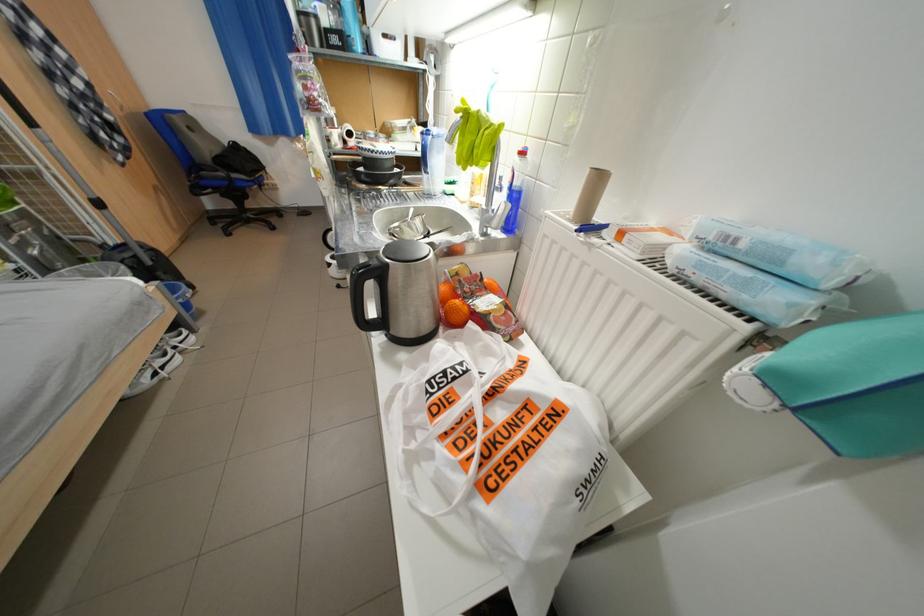
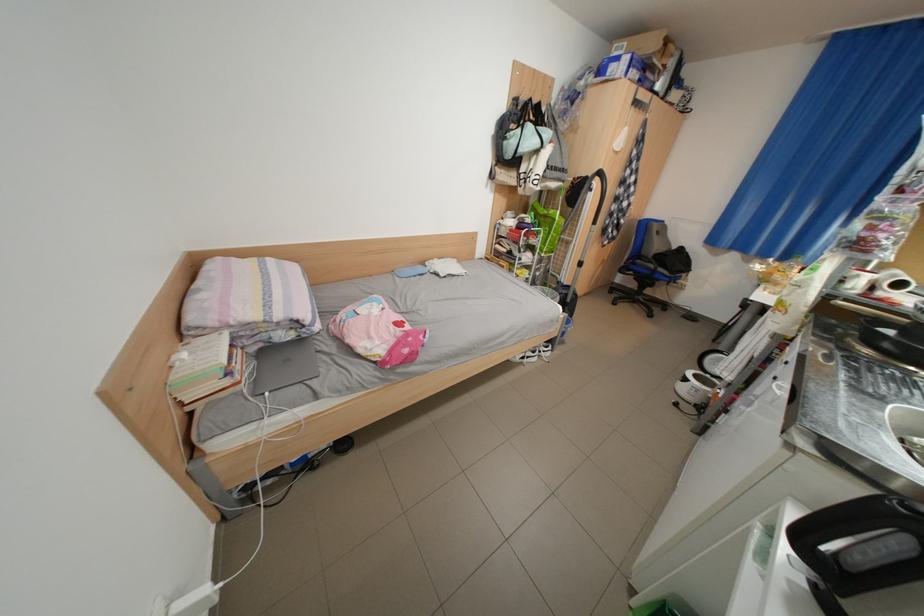
Locate, in the second image, the point that corresponds to pixel 116 261 in the first image.

(565, 291)